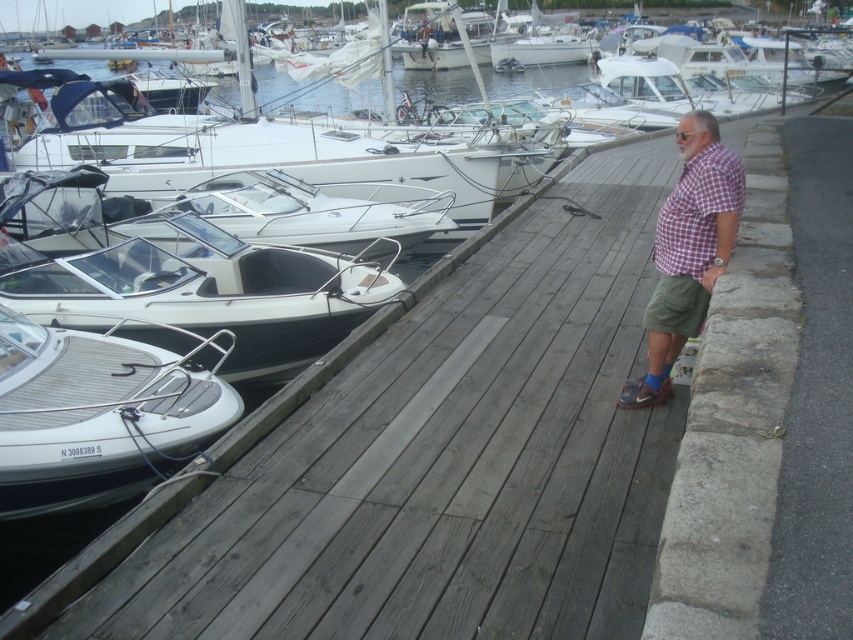
Which is above, white textured boat at left or checkered fabric shirt at center?

checkered fabric shirt at center is higher up.

Is white textured boat at left shorter than checkered fabric shirt at center?

Correct, white textured boat at left is not as tall as checkered fabric shirt at center.

Is point (155, 356) more distant than point (693, 236)?

Yes.

Locate an element on the screen. This screenshot has width=853, height=640. white textured boat at left is located at coordinates (97, 413).

Between gray wood dock at center and checkered fabric shirt at center, which one has more height?

With more height is checkered fabric shirt at center.

Who is shorter, gray wood dock at center or checkered fabric shirt at center?

gray wood dock at center

Who is more distant from viewer, (96, 616) or (695, 257)?

Positioned behind is point (695, 257).

The width and height of the screenshot is (853, 640). In order to click on gray wood dock at center in this screenshot , I will do `click(432, 461)`.

Which is more to the left, gray wood dock at center or white textured boat at left?

From the viewer's perspective, white textured boat at left appears more on the left side.

Can you confirm if gray wood dock at center is positioned to the right of white textured boat at left?

Indeed, gray wood dock at center is positioned on the right side of white textured boat at left.

The width and height of the screenshot is (853, 640). What do you see at coordinates (432, 461) in the screenshot?
I see `gray wood dock at center` at bounding box center [432, 461].

Find the location of a particular element. This screenshot has width=853, height=640. gray wood dock at center is located at coordinates (432, 461).